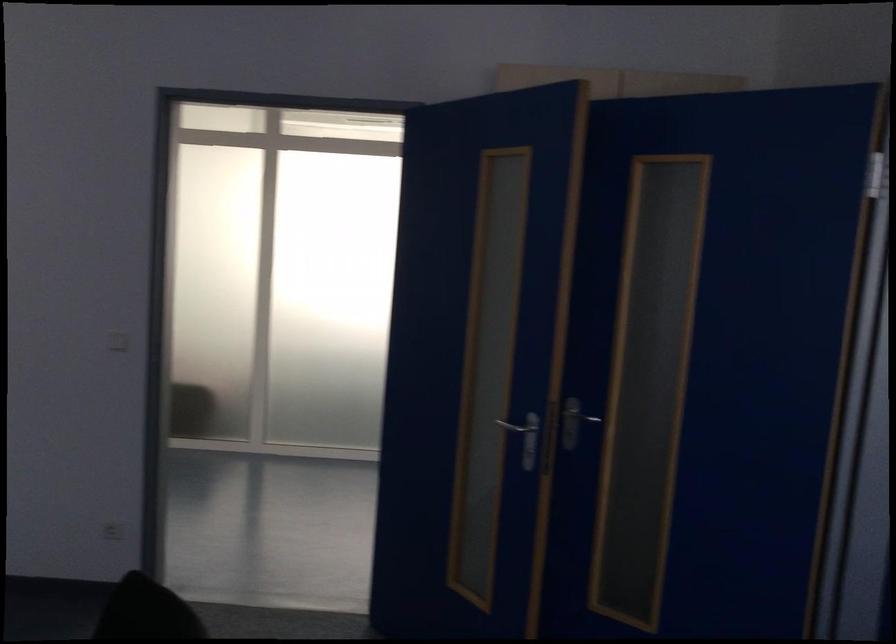
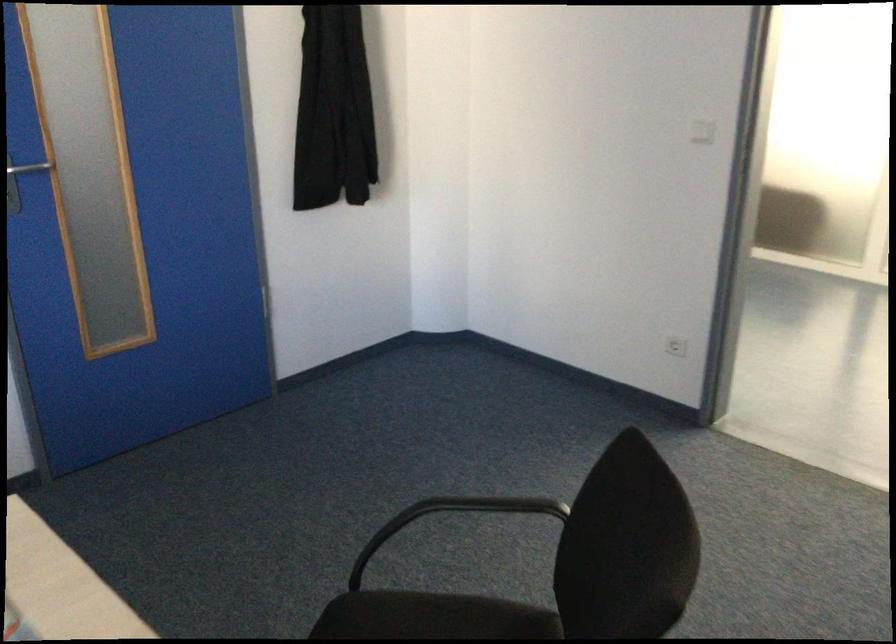
First-person continuous shooting, in which direction is the camera rotating?

The camera rotated toward left-down.